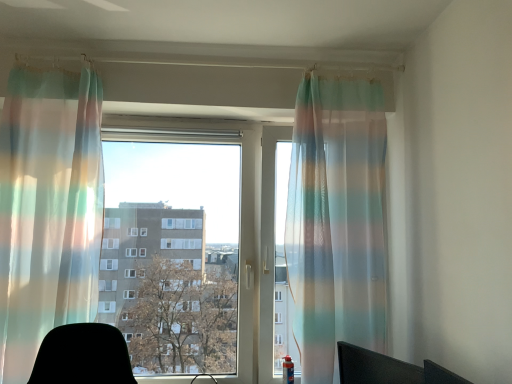
You are a GUI agent. You are given a task and a screenshot of the screen. Output one action in this format:
    pyautogui.click(x=<x>, y=<y>)
    Task: Click on the translucent striped curtain at center, positioned as the second curtain in left-to-right order
    
    Given the screenshot: What is the action you would take?
    coord(336,221)

Describe the element at coordinates (388, 369) in the screenshot. I see `black matte computer chair at lower right` at that location.

The height and width of the screenshot is (384, 512). What are the coordinates of `translucent striped curtain at center, which appears as the 1th curtain when viewed from the right` in the screenshot? It's located at (336, 221).

Is black matte computer chair at lower right shorter than transparent fabric at center?

Correct, black matte computer chair at lower right is not as tall as transparent fabric at center.

Looking at their sizes, would you say black matte computer chair at lower right is wider or thinner than transparent fabric at center?

In the image, black matte computer chair at lower right appears to be wider than transparent fabric at center.

Identify the location of computer chair below the transparent fabric at center (from the image's perspective). (388, 369).

Can you see translucent striped curtain at center, which appears as the 1th curtain when viewed from the right, touching transparent fabric at center?

No, translucent striped curtain at center, which appears as the 1th curtain when viewed from the right, is not beside transparent fabric at center.

Would you say translucent striped curtain at center, positioned as the second curtain in left-to-right order, contains transparent fabric at center?

Actually, transparent fabric at center is outside translucent striped curtain at center, positioned as the second curtain in left-to-right order.

From a real-world perspective, is translucent striped curtain at center, which appears as the 1th curtain when viewed from the right, positioned under transparent fabric at center based on gravity?

No, from a real-world perspective, translucent striped curtain at center, which appears as the 1th curtain when viewed from the right, is not below transparent fabric at center.

Which is behind, point (364, 209) or point (256, 238)?

Positioned behind is point (256, 238).

Which object is wider, translucent striped curtain at center, positioned as the second curtain in left-to-right order, or black matte computer chair at lower right?

With larger width is translucent striped curtain at center, positioned as the second curtain in left-to-right order.

Is point (308, 183) positioned before point (393, 372)?

No.

Considering the relative sizes of translucent striped curtain at center, which appears as the 1th curtain when viewed from the right, and black matte computer chair at lower right in the image provided, is translucent striped curtain at center, which appears as the 1th curtain when viewed from the right, taller than black matte computer chair at lower right?

Correct, translucent striped curtain at center, which appears as the 1th curtain when viewed from the right, is much taller as black matte computer chair at lower right.

How many degrees apart are the facing directions of black matte computer chair at lower right and translucent rainbow striped curtain at left, which is the 1th curtain from left to right?

There is a 68.8-degree angle between the facing directions of black matte computer chair at lower right and translucent rainbow striped curtain at left, which is the 1th curtain from left to right.

From the image's perspective, is black matte computer chair at lower right over translucent rainbow striped curtain at left, the 2th curtain viewed from the right?

Actually, black matte computer chair at lower right appears below translucent rainbow striped curtain at left, the 2th curtain viewed from the right, in the image.

Is black matte computer chair at lower right to the right of translucent rainbow striped curtain at left, which is the 1th curtain from left to right, from the viewer's perspective?

Yes, black matte computer chair at lower right is to the right of translucent rainbow striped curtain at left, which is the 1th curtain from left to right.

How much distance is there between black matte computer chair at lower right and translucent rainbow striped curtain at left, the 2th curtain viewed from the right?

black matte computer chair at lower right and translucent rainbow striped curtain at left, the 2th curtain viewed from the right, are 4.57 feet apart from each other.

Consider the image. Is translucent striped curtain at center, which appears as the 1th curtain when viewed from the right, placed right next to translucent rainbow striped curtain at left, the 2th curtain viewed from the right?

translucent striped curtain at center, which appears as the 1th curtain when viewed from the right, and translucent rainbow striped curtain at left, the 2th curtain viewed from the right, are not in contact.

Does translucent striped curtain at center, which appears as the 1th curtain when viewed from the right, come in front of translucent rainbow striped curtain at left, which is the 1th curtain from left to right?

No.

Looking at this image, which of these two, translucent striped curtain at center, positioned as the second curtain in left-to-right order, or translucent rainbow striped curtain at left, which is the 1th curtain from left to right, is wider?

Wider between the two is translucent rainbow striped curtain at left, which is the 1th curtain from left to right.

From the picture: From the image's perspective, is translucent striped curtain at center, positioned as the second curtain in left-to-right order, under translucent rainbow striped curtain at left, the 2th curtain viewed from the right?

Yes, from the image's perspective, translucent striped curtain at center, positioned as the second curtain in left-to-right order, is beneath translucent rainbow striped curtain at left, the 2th curtain viewed from the right.

Does point (55, 223) appear closer or farther from the camera than point (252, 139)?

Point (55, 223).

Is translucent rainbow striped curtain at left, the 2th curtain viewed from the right, looking in the opposite direction of transparent fabric at center?

Yes, translucent rainbow striped curtain at left, the 2th curtain viewed from the right, is positioned with its back facing transparent fabric at center.

Is translucent rainbow striped curtain at left, the 2th curtain viewed from the right, with transparent fabric at center?

They are not placed beside each other.

From the image's perspective, which is below, translucent rainbow striped curtain at left, which is the 1th curtain from left to right, or transparent fabric at center?

transparent fabric at center, from the image's perspective.

Is translucent rainbow striped curtain at left, which is the 1th curtain from left to right, to the left of black matte computer chair at lower right from the viewer's perspective?

Yes.

How much distance is there between translucent rainbow striped curtain at left, the 2th curtain viewed from the right, and black matte computer chair at lower right?

translucent rainbow striped curtain at left, the 2th curtain viewed from the right, is 4.57 feet away from black matte computer chair at lower right.

You are a GUI agent. You are given a task and a screenshot of the screen. Output one action in this format:
    pyautogui.click(x=<x>, y=<y>)
    Task: Click on the 1st curtain behind when counting from the black matte computer chair at lower right
    This screenshot has width=512, height=384.
    Given the screenshot: What is the action you would take?
    click(48, 209)

This screenshot has height=384, width=512. Find the location of `computer chair in front of the transparent fabric at center`. computer chair in front of the transparent fabric at center is located at coordinates (388, 369).

The image size is (512, 384). What are the coordinates of `window located below the translucent striped curtain at center, positioned as the second curtain in left-to-right order (from the image's perspective)` in the screenshot? It's located at (240, 226).

Which object lies further to the anchor point translucent rainbow striped curtain at left, the 2th curtain viewed from the right, black matte computer chair at lower right or transparent fabric at center?

black matte computer chair at lower right is positioned further to the anchor translucent rainbow striped curtain at left, the 2th curtain viewed from the right.

Considering their positions, is black matte computer chair at lower right positioned closer to translucent rainbow striped curtain at left, the 2th curtain viewed from the right, than translucent striped curtain at center, which appears as the 1th curtain when viewed from the right?

translucent striped curtain at center, which appears as the 1th curtain when viewed from the right.

From the image, which object appears to be farther from transparent fabric at center, translucent striped curtain at center, positioned as the second curtain in left-to-right order, or translucent rainbow striped curtain at left, which is the 1th curtain from left to right?

translucent rainbow striped curtain at left, which is the 1th curtain from left to right, is further to transparent fabric at center.

Considering their positions, is transparent fabric at center positioned further to translucent rainbow striped curtain at left, the 2th curtain viewed from the right, than black matte computer chair at lower right?

black matte computer chair at lower right is further to translucent rainbow striped curtain at left, the 2th curtain viewed from the right.

Estimate the real-world distances between objects in this image. Which object is further from translucent striped curtain at center, positioned as the second curtain in left-to-right order, translucent rainbow striped curtain at left, which is the 1th curtain from left to right, or black matte computer chair at lower right?

translucent rainbow striped curtain at left, which is the 1th curtain from left to right.

Based on their spatial positions, is black matte computer chair at lower right or translucent rainbow striped curtain at left, which is the 1th curtain from left to right, closer to transparent fabric at center?

translucent rainbow striped curtain at left, which is the 1th curtain from left to right.

When comparing their distances from translucent striped curtain at center, positioned as the second curtain in left-to-right order, does transparent fabric at center or black matte computer chair at lower right seem closer?

black matte computer chair at lower right is positioned closer to the anchor translucent striped curtain at center, positioned as the second curtain in left-to-right order.

When comparing their distances from black matte computer chair at lower right, does translucent rainbow striped curtain at left, which is the 1th curtain from left to right, or transparent fabric at center seem closer?

transparent fabric at center is closer to black matte computer chair at lower right.

Where is `window between translucent rainbow striped curtain at left, the 2th curtain viewed from the right, and black matte computer chair at lower right from left to right`? This screenshot has width=512, height=384. window between translucent rainbow striped curtain at left, the 2th curtain viewed from the right, and black matte computer chair at lower right from left to right is located at coordinates (240, 226).

What are the coordinates of `window between translucent rainbow striped curtain at left, which is the 1th curtain from left to right, and translucent striped curtain at center, positioned as the second curtain in left-to-right order, in the horizontal direction` in the screenshot? It's located at (240, 226).

Where is `curtain between translucent rainbow striped curtain at left, the 2th curtain viewed from the right, and black matte computer chair at lower right from left to right`? The width and height of the screenshot is (512, 384). curtain between translucent rainbow striped curtain at left, the 2th curtain viewed from the right, and black matte computer chair at lower right from left to right is located at coordinates (336, 221).

The image size is (512, 384). Find the location of `curtain situated between transparent fabric at center and black matte computer chair at lower right from left to right`. curtain situated between transparent fabric at center and black matte computer chair at lower right from left to right is located at coordinates pos(336,221).